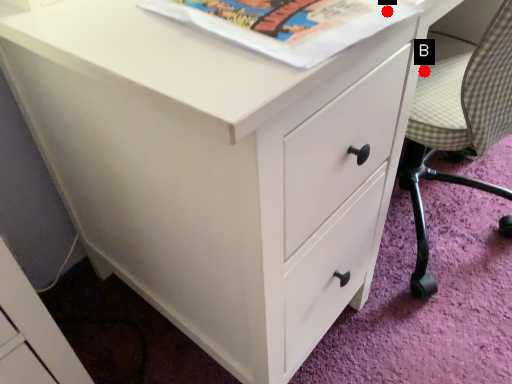
Question: Two points are circled on the image, labeled by A and B beside each circle. Which point appears farthest from the camera in this image?

Choices:
 (A) A is further
 (B) B is further

Answer: (B)